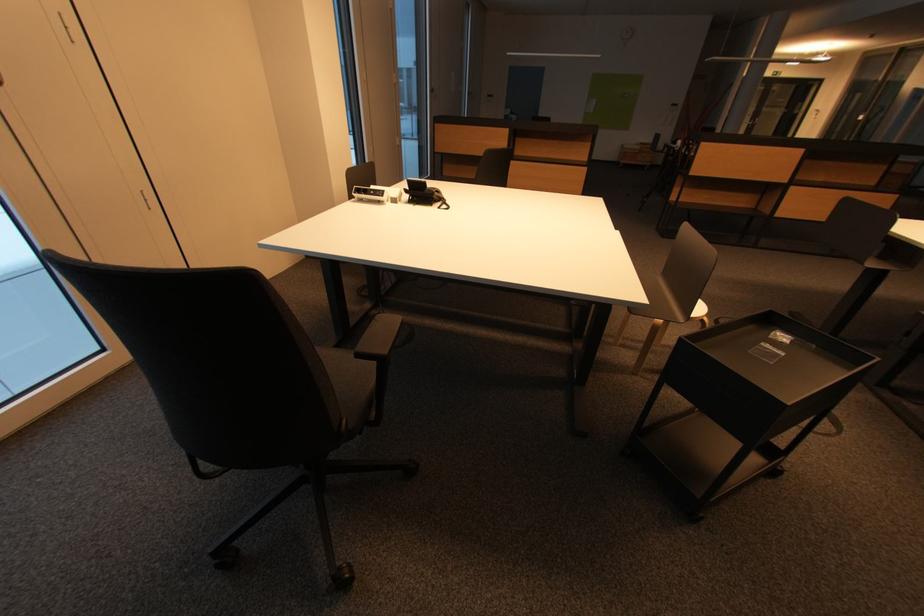
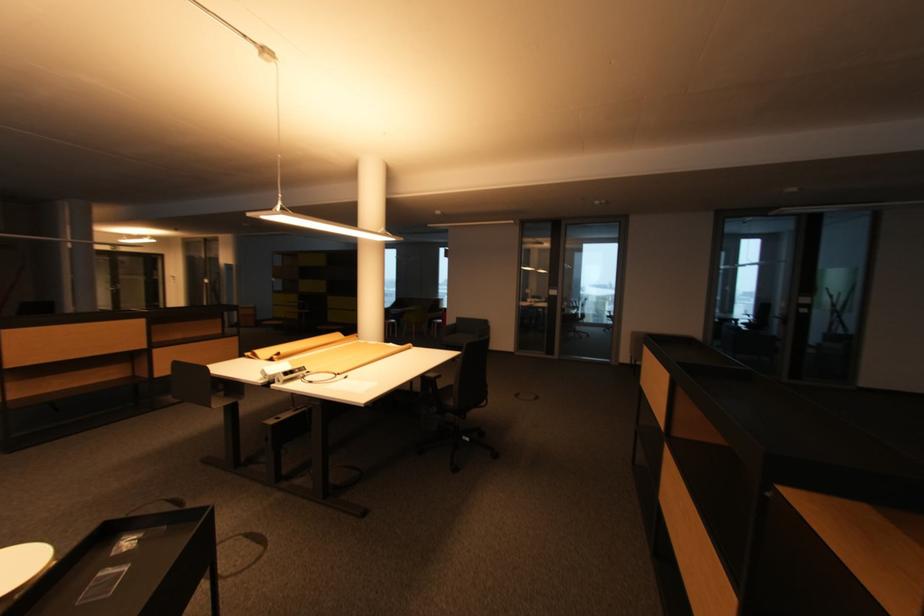
Question: The images are taken continuously from a first-person perspective. In which direction is your viewpoint rotating?

Choices:
 (A) Left
 (B) Right
 (C) Up
 (D) Down

Answer: (B)